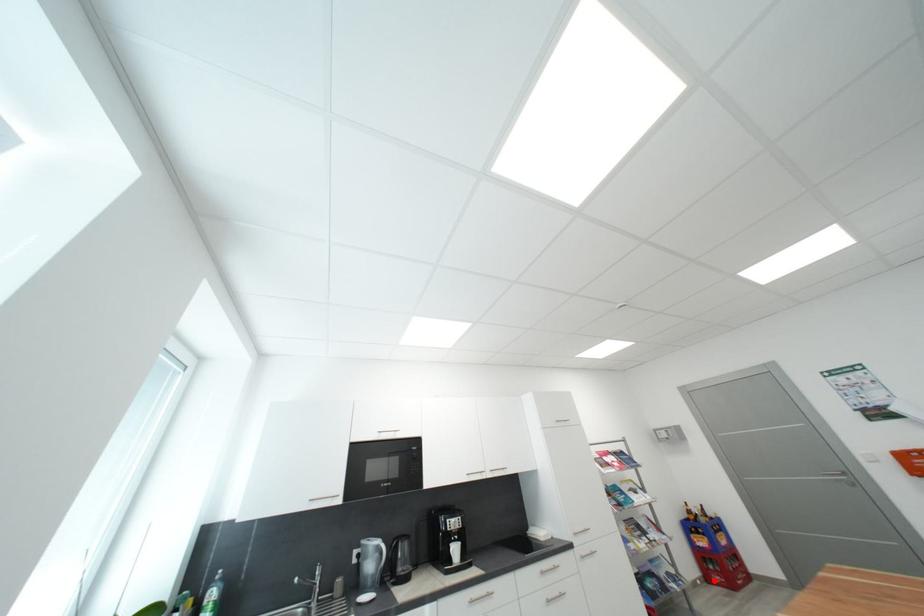
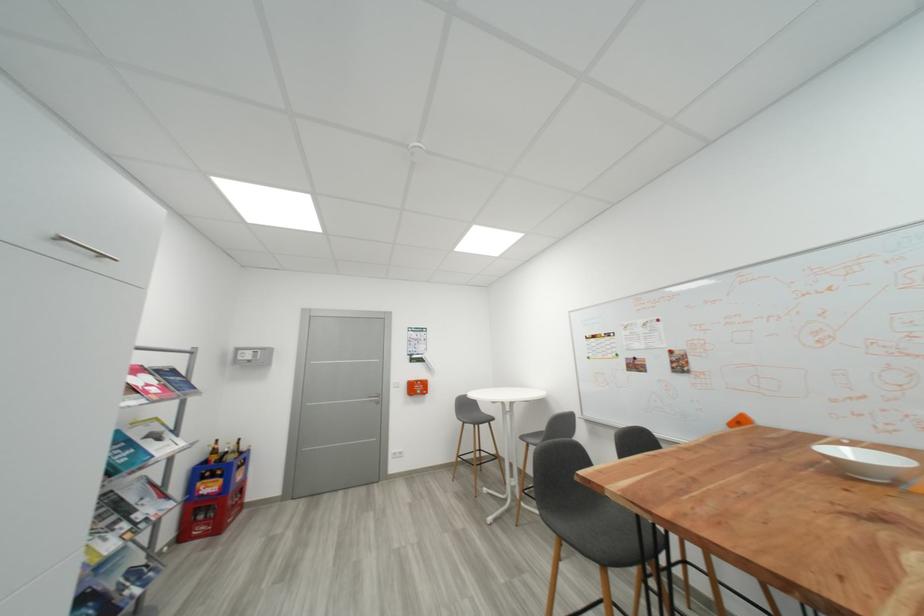
Question: I am providing you with two images of the same scene from different viewpoints. A red point is shown in image1. For the corresponding object point in image2, is it positioned nearer or farther from the camera?

Choices:
 (A) Nearer
 (B) Farther

Answer: (A)